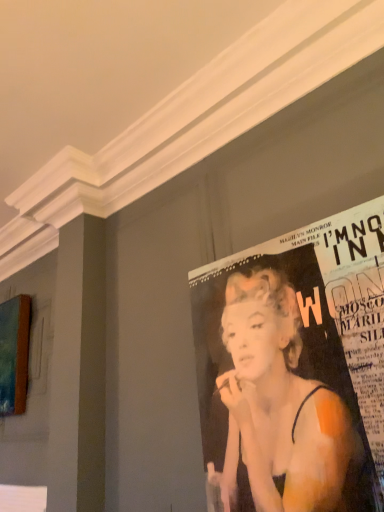
Question: From the image's perspective, is teal canvas painting at left above or below matte paper poster at upper right?

Choices:
 (A) above
 (B) below

Answer: (B)

Question: Relative to matte paper poster at upper right, is teal canvas painting at left in front or behind?

Choices:
 (A) front
 (B) behind

Answer: (B)

Question: From a real-world perspective, is teal canvas painting at left positioned above or below matte paper poster at upper right?

Choices:
 (A) below
 (B) above

Answer: (B)

Question: Is matte paper poster at upper right situated inside teal canvas painting at left or outside?

Choices:
 (A) inside
 (B) outside

Answer: (B)

Question: Based on their positions, is matte paper poster at upper right located to the left or right of teal canvas painting at left?

Choices:
 (A) right
 (B) left

Answer: (A)

Question: Looking at the image, does matte paper poster at upper right seem bigger or smaller compared to teal canvas painting at left?

Choices:
 (A) small
 (B) big

Answer: (A)

Question: Looking at their shapes, would you say matte paper poster at upper right is wider or thinner than teal canvas painting at left?

Choices:
 (A) wide
 (B) thin

Answer: (B)